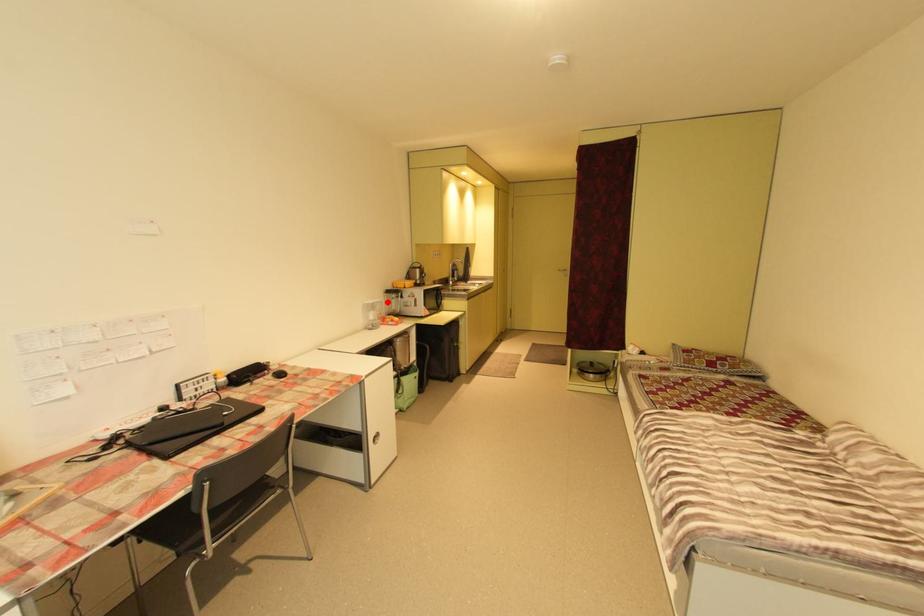
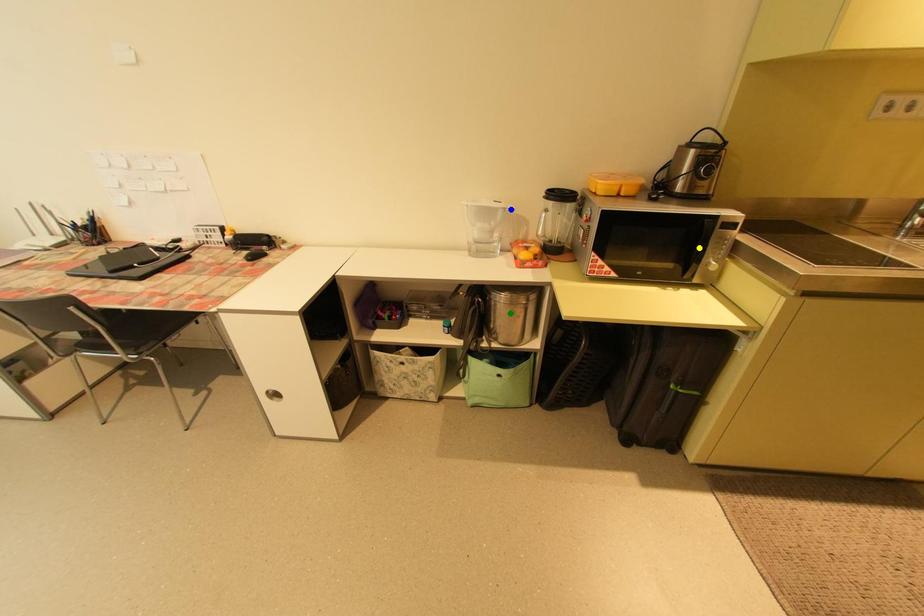
Question: I am providing you with two images of the same scene from different viewpoints. A red point is marked on the first image. You are given multiple points on the second image. Which spot in image 2 lines up with the point in image 1?

Choices:
 (A) blue point
 (B) green point
 (C) yellow point

Answer: (A)